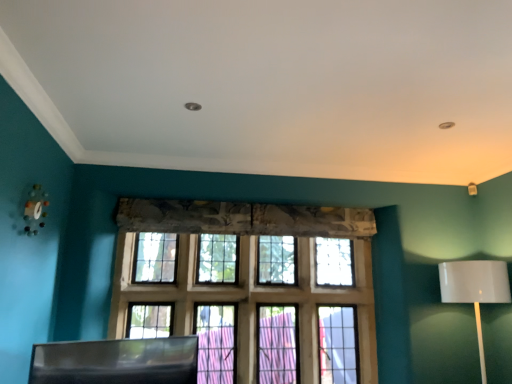
Question: Does black plastic swivel chair at lower left turn towards white glossy table lamp at right?

Choices:
 (A) yes
 (B) no

Answer: (B)

Question: Can you confirm if black plastic swivel chair at lower left is positioned to the right of white glossy table lamp at right?

Choices:
 (A) yes
 (B) no

Answer: (B)

Question: Is black plastic swivel chair at lower left further to camera compared to white glossy table lamp at right?

Choices:
 (A) yes
 (B) no

Answer: (B)

Question: Is black plastic swivel chair at lower left shorter than white glossy table lamp at right?

Choices:
 (A) no
 (B) yes

Answer: (B)

Question: Is white glossy table lamp at right a part of black plastic swivel chair at lower left?

Choices:
 (A) yes
 (B) no

Answer: (B)

Question: Based on their positions, is wooden grid window at center located to the left or right of black plastic swivel chair at lower left?

Choices:
 (A) right
 (B) left

Answer: (A)

Question: Is wooden grid window at center wider or thinner than black plastic swivel chair at lower left?

Choices:
 (A) thin
 (B) wide

Answer: (B)

Question: Is wooden grid window at center bigger or smaller than black plastic swivel chair at lower left?

Choices:
 (A) big
 (B) small

Answer: (A)

Question: From the image's perspective, is wooden grid window at center positioned above or below black plastic swivel chair at lower left?

Choices:
 (A) below
 (B) above

Answer: (B)

Question: Is point (44, 382) closer or farther from the camera than point (509, 296)?

Choices:
 (A) farther
 (B) closer

Answer: (B)

Question: Is black plastic swivel chair at lower left in front of or behind white glossy table lamp at right in the image?

Choices:
 (A) behind
 (B) front

Answer: (B)

Question: Based on their sizes in the image, would you say black plastic swivel chair at lower left is bigger or smaller than white glossy table lamp at right?

Choices:
 (A) small
 (B) big

Answer: (A)

Question: From a real-world perspective, is black plastic swivel chair at lower left above or below white glossy table lamp at right?

Choices:
 (A) above
 (B) below

Answer: (B)

Question: Based on their sizes in the image, would you say white glossy table lamp at right is bigger or smaller than black plastic swivel chair at lower left?

Choices:
 (A) small
 (B) big

Answer: (B)

Question: From a real-world perspective, is white glossy table lamp at right physically located above or below black plastic swivel chair at lower left?

Choices:
 (A) above
 (B) below

Answer: (A)